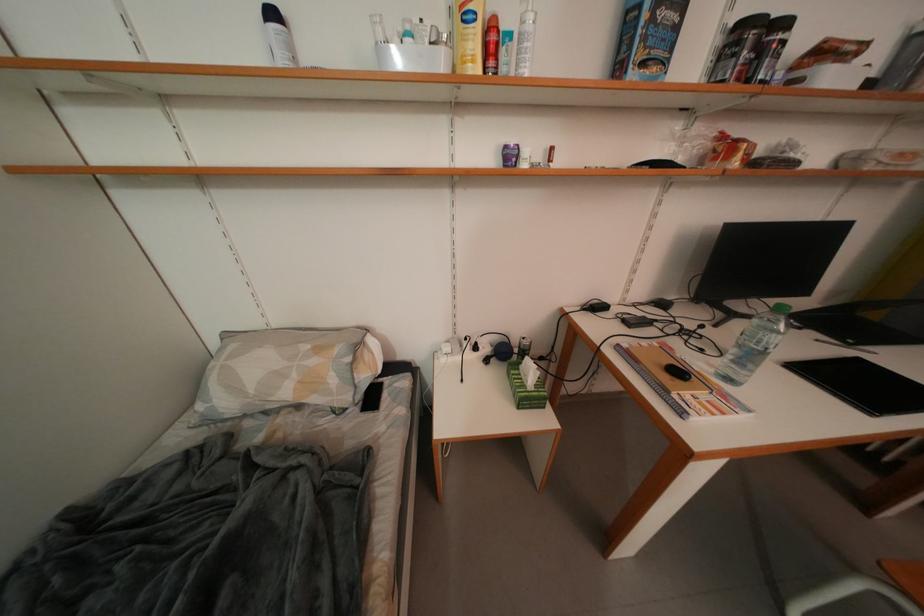
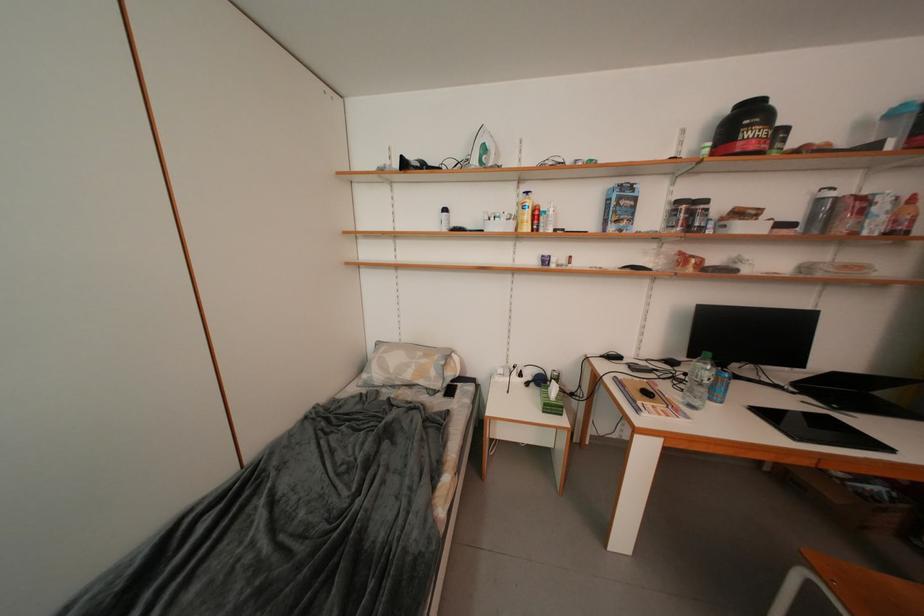
Question: The images are taken continuously from a first-person perspective. In which direction are you moving?

Choices:
 (A) Left
 (B) Right
 (C) Forward
 (D) Backward

Answer: (D)